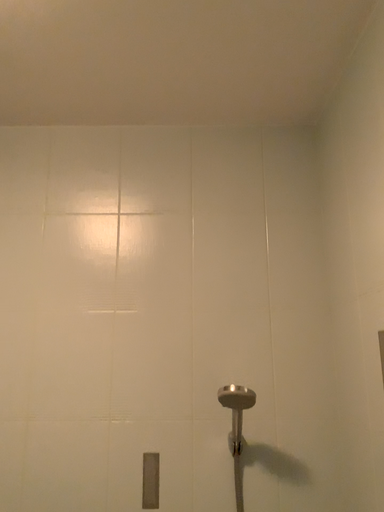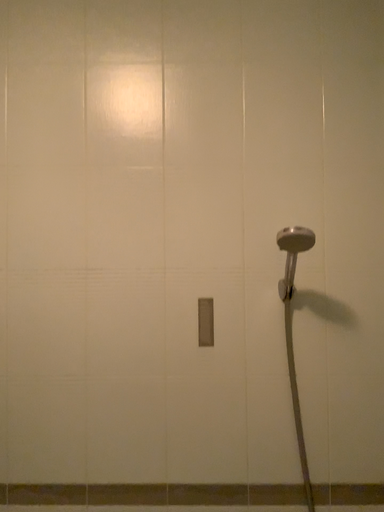
Question: How did the camera likely rotate when shooting the video?

Choices:
 (A) rotated downward
 (B) rotated upward

Answer: (A)